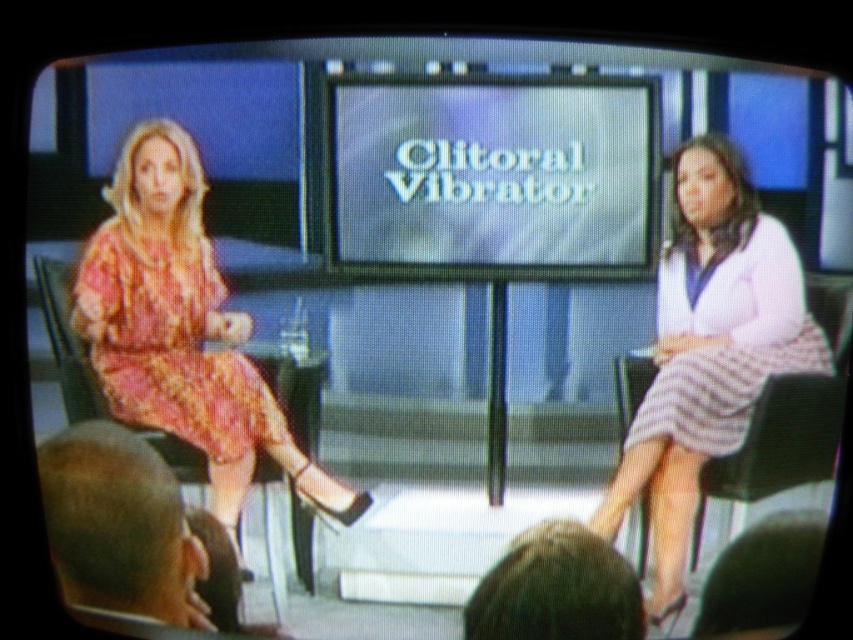
You are a camera operator adjusting the focus on a zoom lens. The point you need to focus on is point (479, 109). The current focus is set to 5 feet. Do you need to adjust the focus to capture the point clearly?

The point (479, 109) is 4.37 feet away from the camera, so yes, you need to adjust the focus to 4.37 feet to capture it clearly.